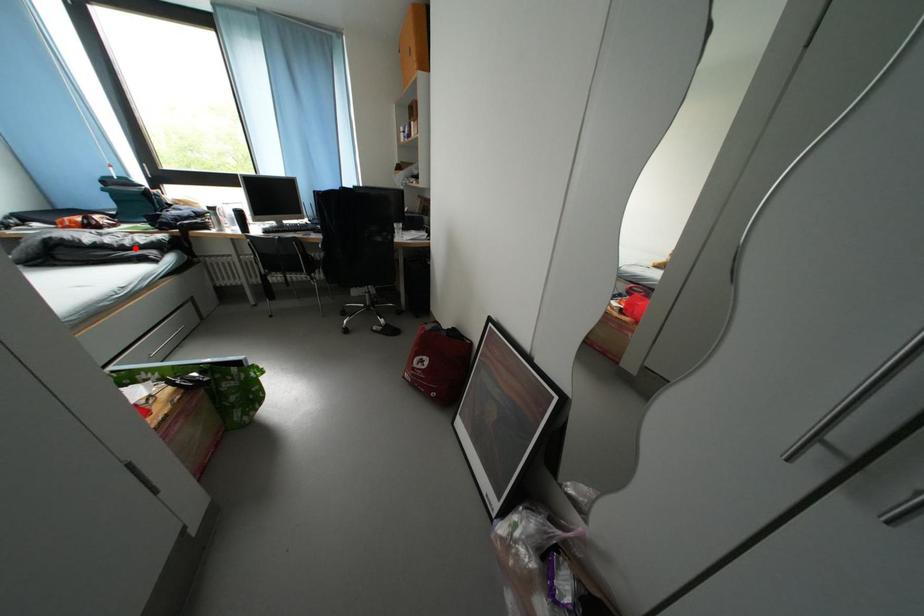
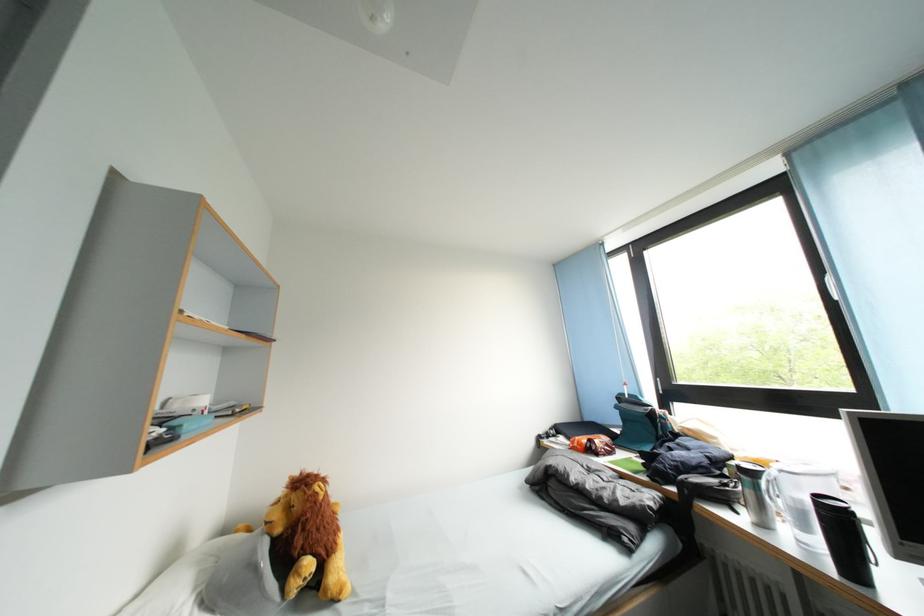
Locate, in the second image, the point that corresponds to the highlighted location in the first image.

(614, 501)